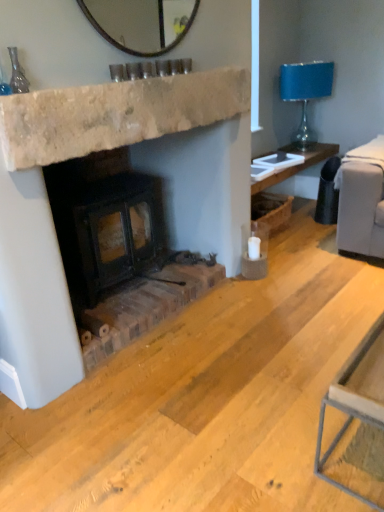
Locate an element on the screen. The image size is (384, 512). blank space situated above natural stone fireplace at center (from a real-world perspective) is located at coordinates (147, 73).